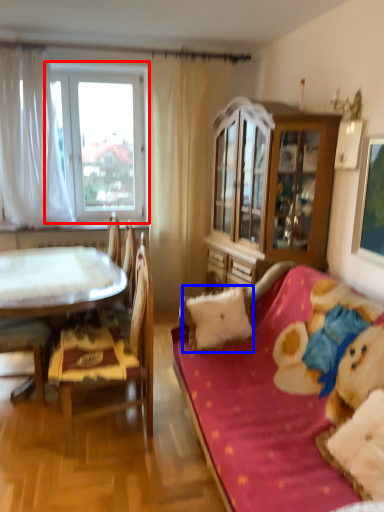
Question: Which object appears closest to the camera in this image, window (highlighted by a red box) or pillow (highlighted by a blue box)?

Choices:
 (A) window
 (B) pillow

Answer: (B)